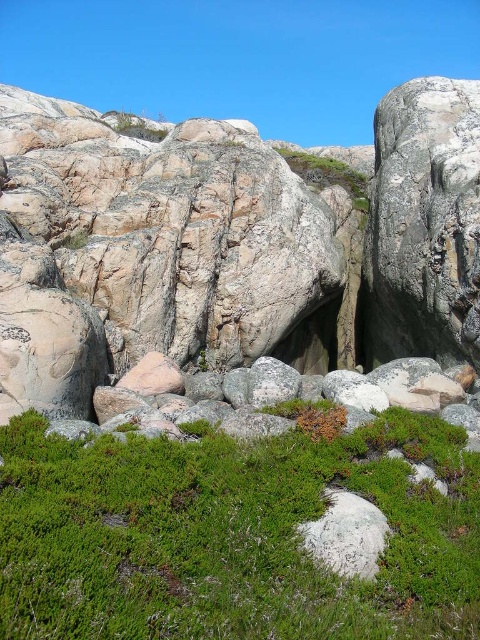
You are a hiker trying to find a safe spot to set up your tent. You see the green soft grass at lower center and the smooth rock hole at center. Which location would provide a flatter surface for your tent?

The smooth rock hole at center is flatter than the green soft grass at lower center, so it would provide a better surface for setting up the tent.